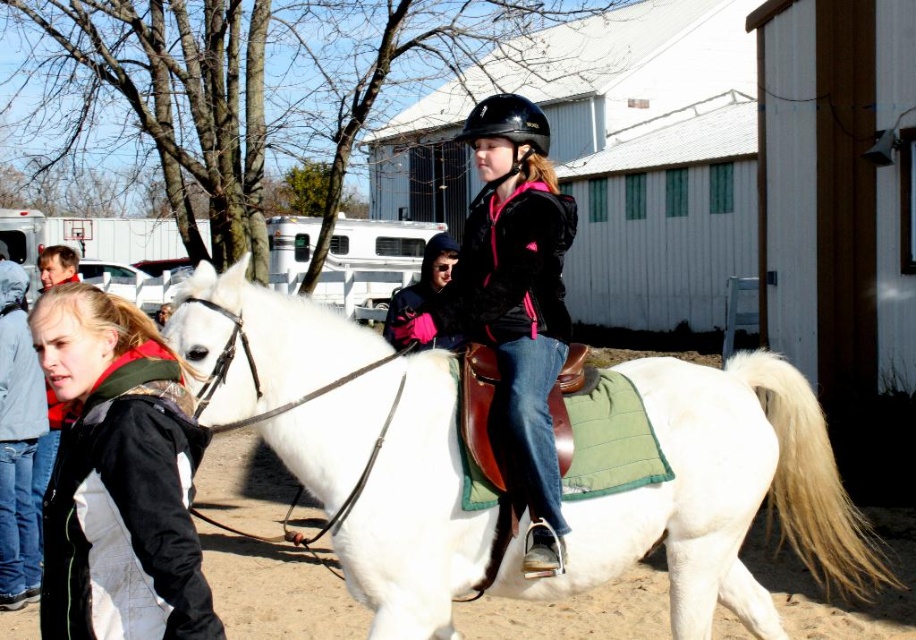
You are standing at the center of the image and want to find the black fleece jacket at lower left. In which direction should you look to see it?

You should look to the lower left direction to see the black fleece jacket at lower left since its 2D location is at point (118, 477).

You are a photographer standing at the edge of the scene. You need to capture a photo that includes both the black fleece jacket at lower left and the matte black helmet at center. What is the minimum distance you must move backward to ensure both are in frame?

The black fleece jacket at lower left is 1.82 meters from the matte black helmet at center. To capture both in frame, you must move back at least 1.82 meters to ensure both are visible.